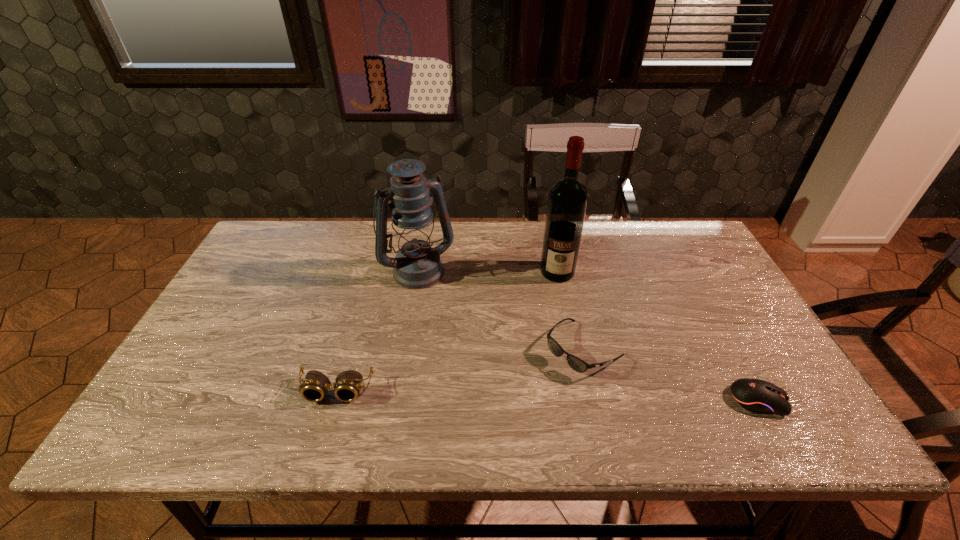
In order to click on object situated at the right edge in this screenshot , I will do `click(758, 396)`.

Find the location of a particular element. Image resolution: width=960 pixels, height=540 pixels. object that is at the near right corner is located at coordinates (758, 396).

Identify the location of vacant space at the far edge. The height and width of the screenshot is (540, 960). (590, 231).

You are a GUI agent. You are given a task and a screenshot of the screen. Output one action in this format:
    pyautogui.click(x=<x>, y=<y>)
    Task: Click on the blank area at the near edge
    
    Given the screenshot: What is the action you would take?
    569,398

In the image, there is a desktop. At what (x,y) coordinates should I click in order to perform the action: click on free space at the left edge. Please return your answer as a coordinate pair (x, y). Looking at the image, I should click on [243, 326].

Image resolution: width=960 pixels, height=540 pixels. Find the location of `vacant area at the right edge`. vacant area at the right edge is located at coordinates (720, 299).

Find the location of a particular element. This screenshot has width=960, height=540. blank area at the near left corner is located at coordinates (231, 386).

The image size is (960, 540). Find the location of `vacant space at the far right corner of the desktop`. vacant space at the far right corner of the desktop is located at coordinates (702, 240).

At what (x,y) coordinates should I click in order to perform the action: click on vacant space in between the computer mouse and the goggles. Please return your answer as a coordinate pair (x, y). Looking at the image, I should click on 547,395.

Locate an element on the screen. Image resolution: width=960 pixels, height=540 pixels. blank region between the goggles and the computer mouse is located at coordinates (547, 395).